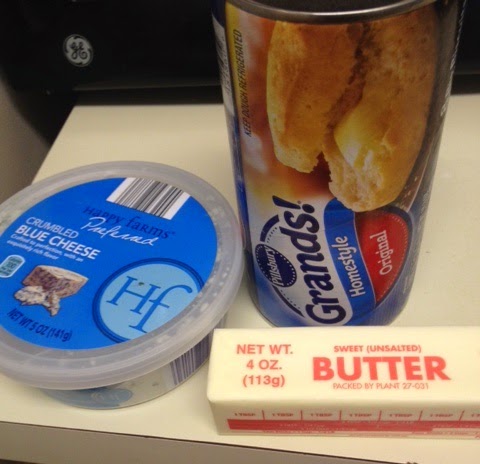
The width and height of the screenshot is (480, 464). In order to click on top of white table in this screenshot , I will do `click(89, 118)`, `click(191, 142)`, `click(469, 126)`, `click(453, 261)`, `click(441, 457)`, `click(185, 409)`, `click(19, 401)`.